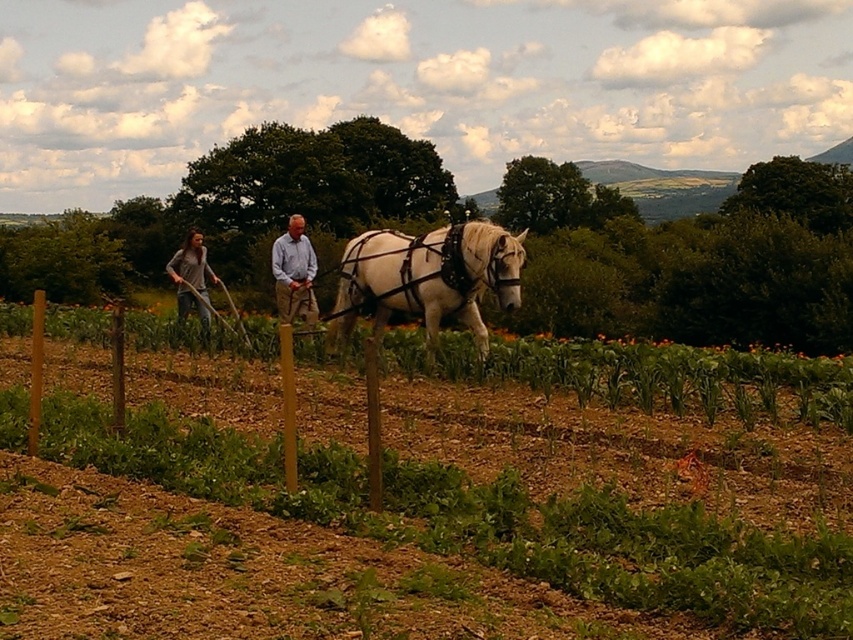
You are standing at the point with coordinates (x=426, y=278) in the image. What object are you standing on?

You are standing on the white glossy horse at center represented by point (x=426, y=278).

You are a farmer standing at the edge of the field. You need to place both the light brown cotton shirt at center and the light brown wooden coach at center on a shelf that can only hold items of equal width. Can you do this?

The light brown cotton shirt at center is wider than the light brown wooden coach at center, so they cannot be placed on the shelf since their widths are not equal.

You are a farmer standing in the field looking towards the wooden fence. You see the green leafy vines at center and the gray cotton shirt at left. Which object is closer to the ground?

The green leafy vines at center is closer to the ground because it is below the gray cotton shirt at left.